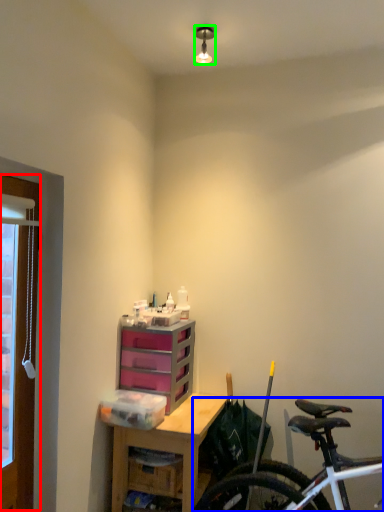
Question: Which object is positioned farthest from window frame (highlighted by a red box)? Select from bicycle (highlighted by a blue box) and lamp (highlighted by a green box).

Choices:
 (A) bicycle
 (B) lamp

Answer: (B)